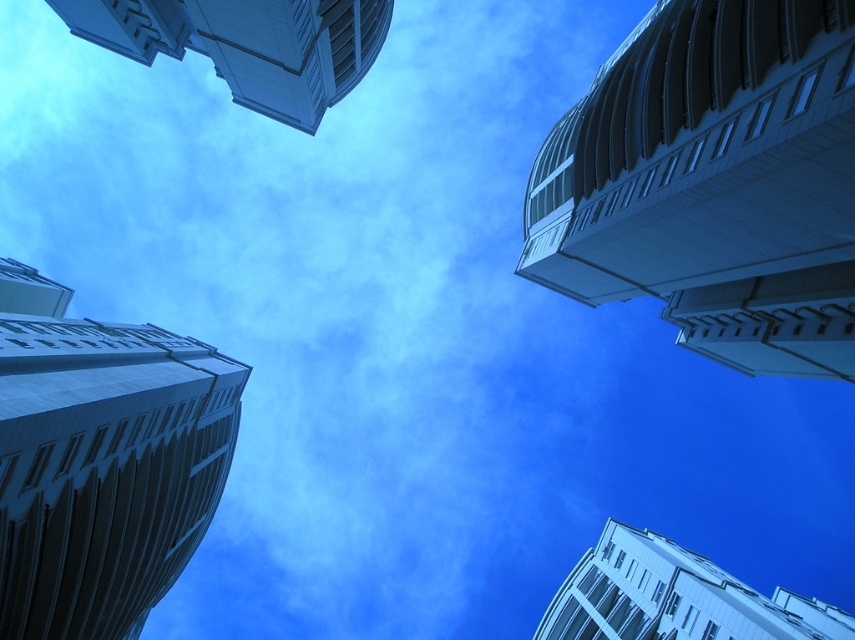
From the picture: You are a window cleaner using a ladder that can extend up to 10 meters. You need to clean the windows of the white glossy building at upper left and the white glossy building at upper right. Which building requires a taller ladder?

The white glossy building at upper left might be wider than white glossy building at upper right, but the question is about the height of the ladder needed. Since the buildings are both white glossy and in the upper part of the image, their heights are similar. The width difference doesn not affect ladder height. Therefore, either building would require a ladder of the same height, so the 10 meter ladder should suffice for both.